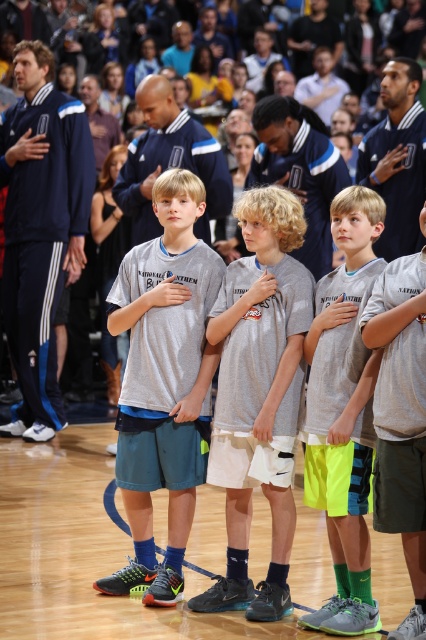
You are standing at point (175,480) and want to take a photo of the basketball court scene. If your camera is 20.22 feet away from you, will the entire scene be in frame?

The point (175,480) and camera are 20.22 feet apart from each other, so the entire scene will be in frame as the distance matches the required focal length.

You are a photographer at the basketball court. You need to take a photo of the gray fabric shirt at center. Where should you focus your camera? Please provide the coordinates in the format of point followed by the coordinate numbers. For example, point 0.5,0.5.

You should focus your camera at point (164,384) to capture the gray fabric shirt at center.

In the scene shown: You are a photographer at the basketball court. You need to capture a photo of the gray fabric shirt at center and neon green shorts at center. Which object should you focus on first if you want to include both in the frame without moving the camera?

The gray fabric shirt at center is much taller than the neon green shorts at center, so you should focus on the gray fabric shirt at center first to ensure it fits in the frame.